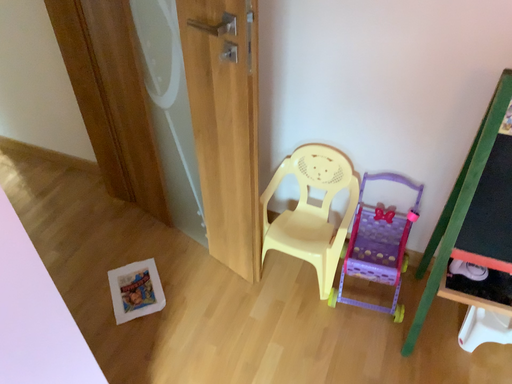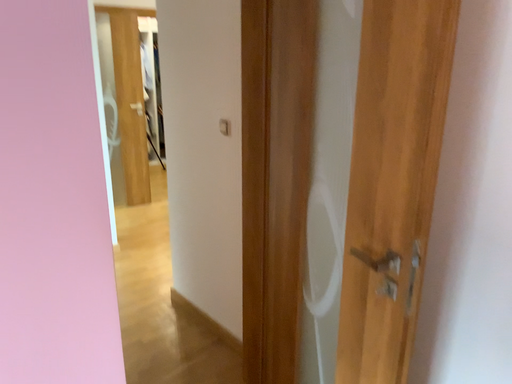
Question: Which way did the camera rotate in the video?

Choices:
 (A) rotated left
 (B) rotated right

Answer: (A)